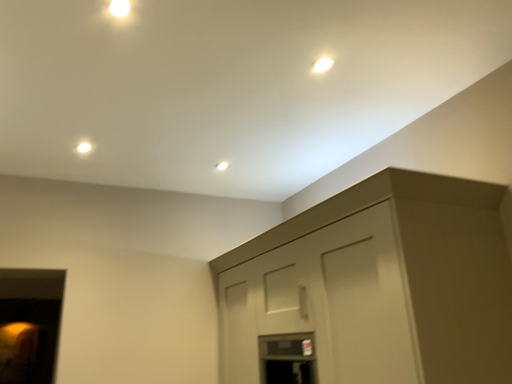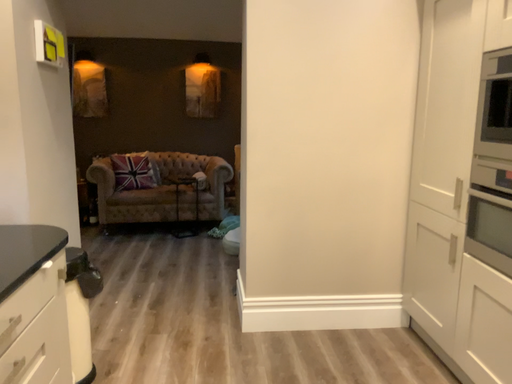
Question: Which way did the camera rotate in the video?

Choices:
 (A) rotated left
 (B) rotated right

Answer: (A)